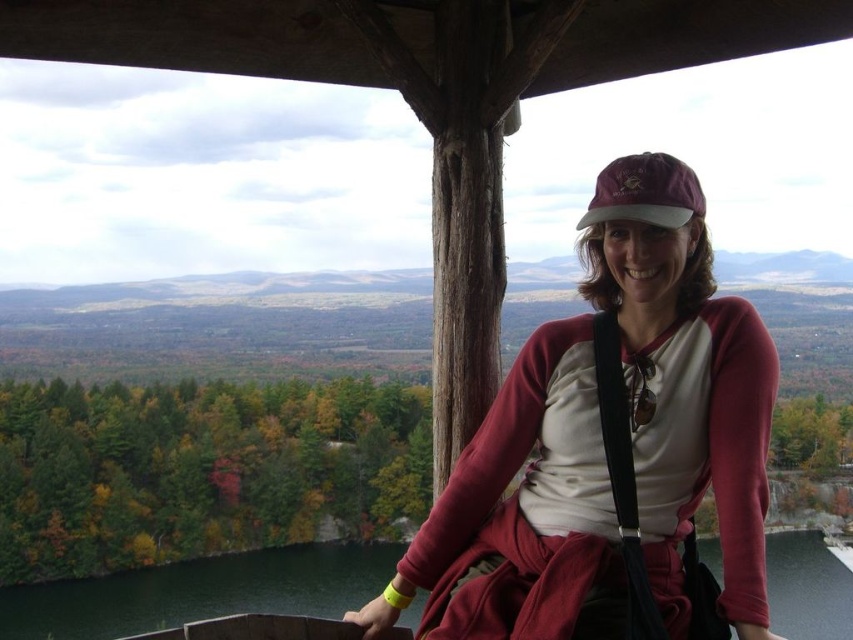
Is matte pink sweater at center smaller than maroon fabric baseball cap at upper center?

Actually, matte pink sweater at center might be larger than maroon fabric baseball cap at upper center.

Can you confirm if matte pink sweater at center is thinner than maroon fabric baseball cap at upper center?

Answer: Incorrect, matte pink sweater at center's width is not less than maroon fabric baseball cap at upper center's.

The image size is (853, 640). Identify the location of matte pink sweater at center. (610, 445).